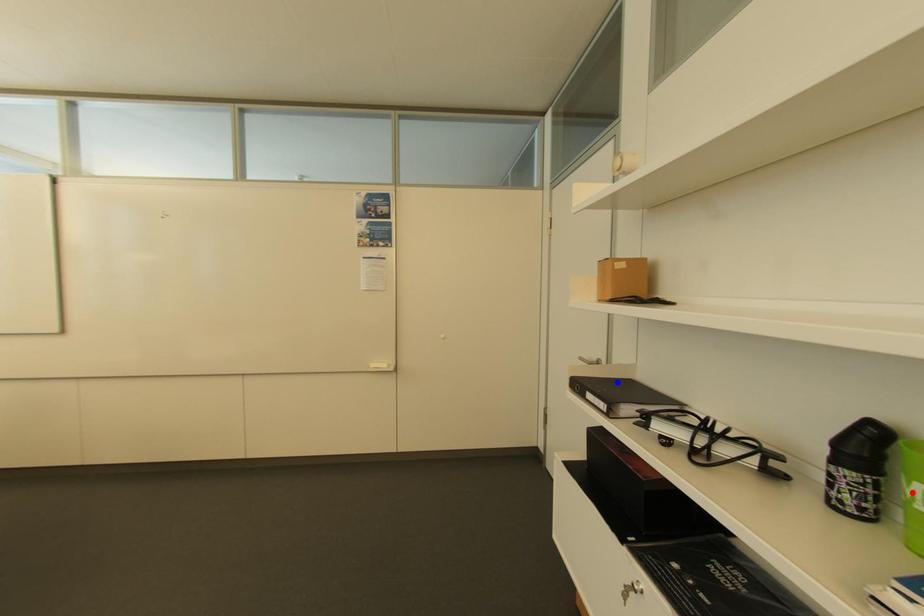
Question: In the image, two points are highlighted. Which point is nearer to the camera? Reply with the corresponding letter.

Choices:
 (A) blue point
 (B) red point

Answer: (B)